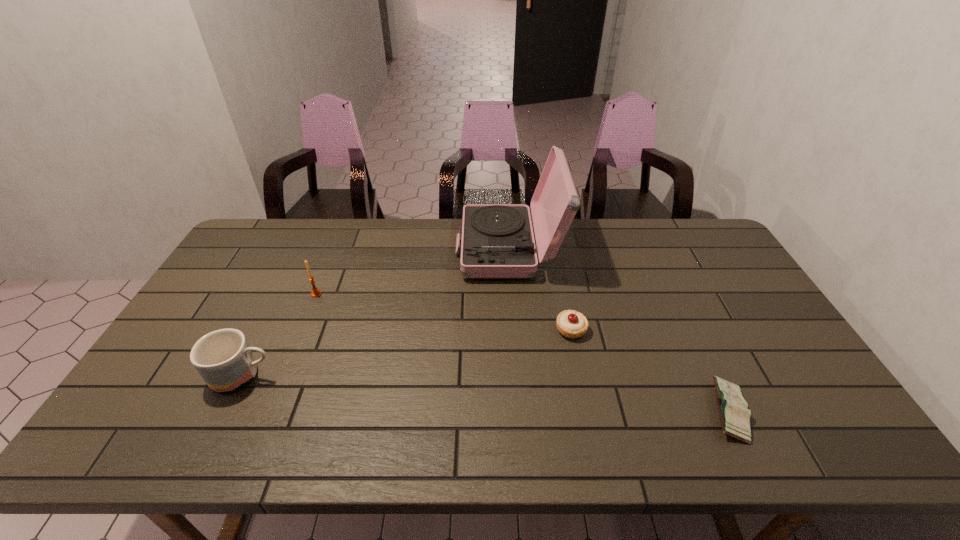
This screenshot has height=540, width=960. In order to click on vacant space located 0.210m with the lid open on the tallest object in this screenshot , I will do `click(396, 249)`.

Where is `vacant space located 0.160m with the lid open on the tallest object`? This screenshot has width=960, height=540. vacant space located 0.160m with the lid open on the tallest object is located at coordinates (410, 249).

Where is `free location located with the lid open on the tallest object`? free location located with the lid open on the tallest object is located at coordinates (347, 249).

At what (x,y) coordinates should I click in order to perform the action: click on vacant space situated on the right of the candle_holder. Please return your answer as a coordinate pair (x, y). This screenshot has height=540, width=960. Looking at the image, I should click on (451, 294).

Locate an element on the screen. free space located on the side with the handle of the mug is located at coordinates (323, 376).

The height and width of the screenshot is (540, 960). Identify the location of vacant point located on the back of the pastry. (565, 304).

Locate an element on the screen. free space located 0.130m on the left of the shortest object is located at coordinates (653, 411).

In order to click on object that is positioned at the far edge in this screenshot , I will do `click(497, 241)`.

This screenshot has width=960, height=540. I want to click on object present at the near edge, so click(x=734, y=414).

Locate an element on the screen. The width and height of the screenshot is (960, 540). object present at the left edge is located at coordinates (223, 358).